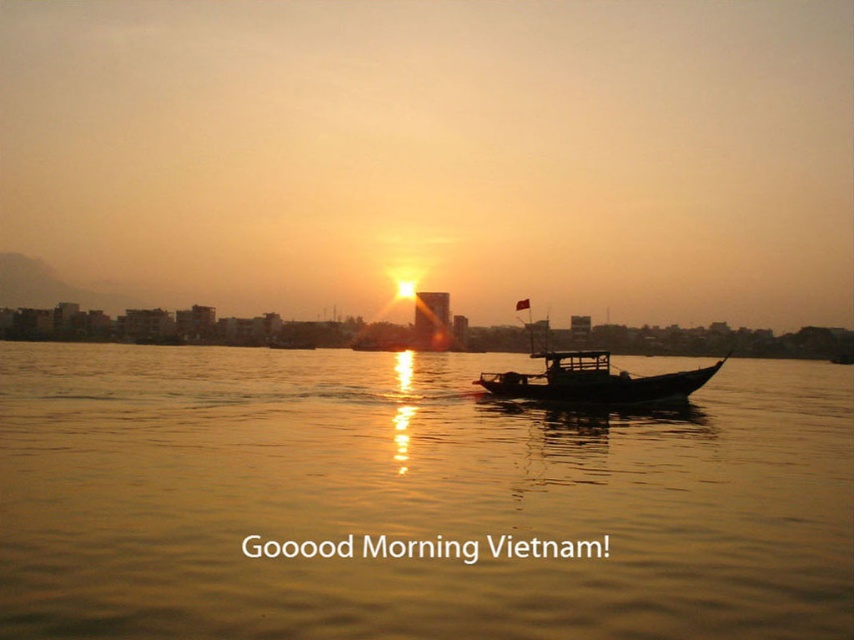
Can you confirm if wooden boat at center is positioned to the left of wooden canoe at center?

Incorrect, wooden boat at center is not on the left side of wooden canoe at center.

What do you see at coordinates (594, 381) in the screenshot?
I see `wooden boat at center` at bounding box center [594, 381].

Where is `wooden boat at center`? Image resolution: width=854 pixels, height=640 pixels. wooden boat at center is located at coordinates (594, 381).

Find the location of a particular element. Image resolution: width=854 pixels, height=640 pixels. wooden boat at center is located at coordinates (594, 381).

Where is `golden reflective water at center`? golden reflective water at center is located at coordinates (411, 500).

Does golden reflective water at center appear under wooden boat at center?

Yes, golden reflective water at center is below wooden boat at center.

The image size is (854, 640). Describe the element at coordinates (411, 500) in the screenshot. I see `golden reflective water at center` at that location.

Image resolution: width=854 pixels, height=640 pixels. Identify the location of golden reflective water at center. click(411, 500).

Does point (180, 580) lie in front of point (569, 384)?

Yes.

Which is more to the right, golden reflective water at center or wooden canoe at center?

Positioned to the right is wooden canoe at center.

Between point (706, 454) and point (583, 381), which one is positioned behind?

Point (583, 381)

Where is `golden reflective water at center`? Image resolution: width=854 pixels, height=640 pixels. golden reflective water at center is located at coordinates (411, 500).